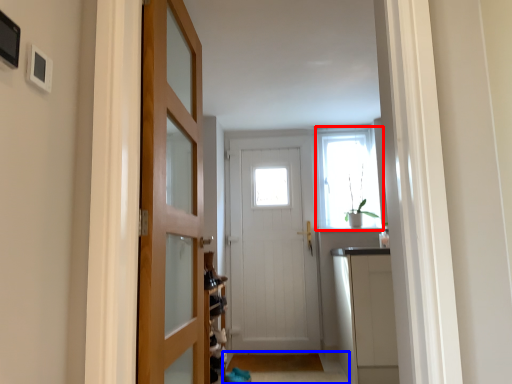
Question: Which object appears farthest to the camera in this image, window (highlighted by a red box) or path (highlighted by a blue box)?

Choices:
 (A) window
 (B) path

Answer: (A)